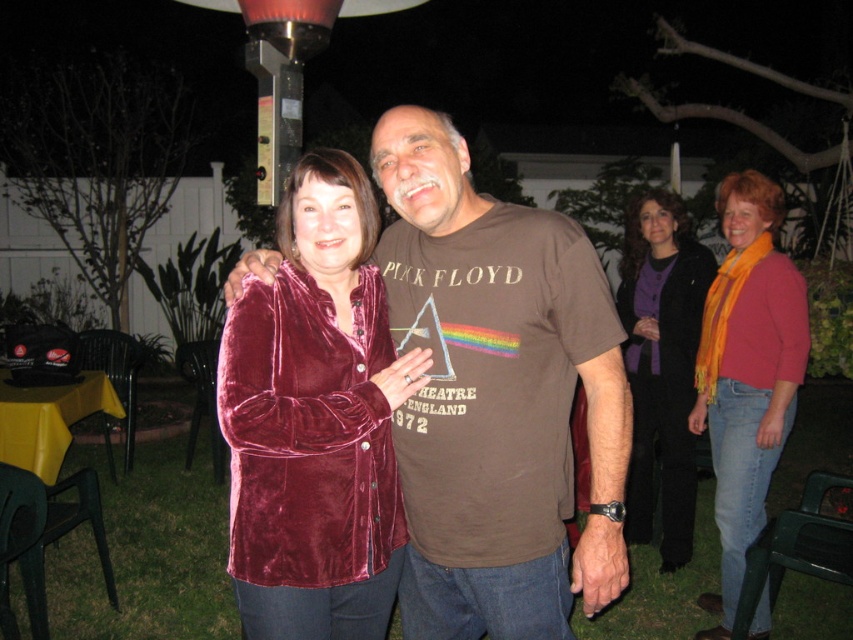
Which is more to the right, velvet burgundy coat at center or purple velvet scarf at upper right?

velvet burgundy coat at center

Does point (766, 241) come in front of point (648, 288)?

That is True.

You are a GUI agent. You are given a task and a screenshot of the screen. Output one action in this format:
    pyautogui.click(x=<x>, y=<y>)
    Task: Click on the velvet burgundy coat at center
    
    Given the screenshot: What is the action you would take?
    pyautogui.click(x=747, y=372)

Consider the image. Is brown cotton t-shirt at center positioned in front of velvet maroon jacket at center?

No.

Who is more forward, (430, 424) or (242, 308)?

Positioned in front is point (242, 308).

The width and height of the screenshot is (853, 640). What do you see at coordinates (498, 397) in the screenshot?
I see `brown cotton t-shirt at center` at bounding box center [498, 397].

Locate an element on the screen. brown cotton t-shirt at center is located at coordinates (498, 397).

Which is in front, point (303, 547) or point (717, 513)?

Point (303, 547) is in front.

Between point (229, 310) and point (749, 490), which one is positioned behind?

Point (749, 490)

Where is `velvet maroon jacket at center`? velvet maroon jacket at center is located at coordinates (315, 419).